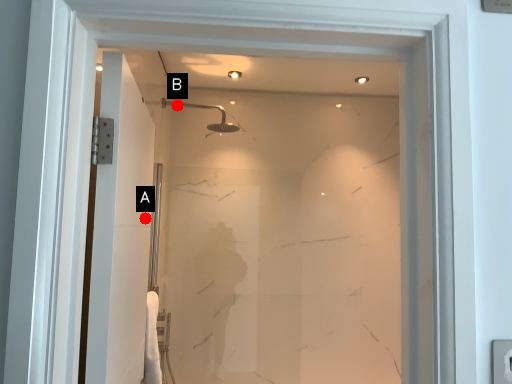
Question: Two points are circled on the image, labeled by A and B beside each circle. Among these points, which one is nearest to the camera?

Choices:
 (A) A is closer
 (B) B is closer

Answer: (A)